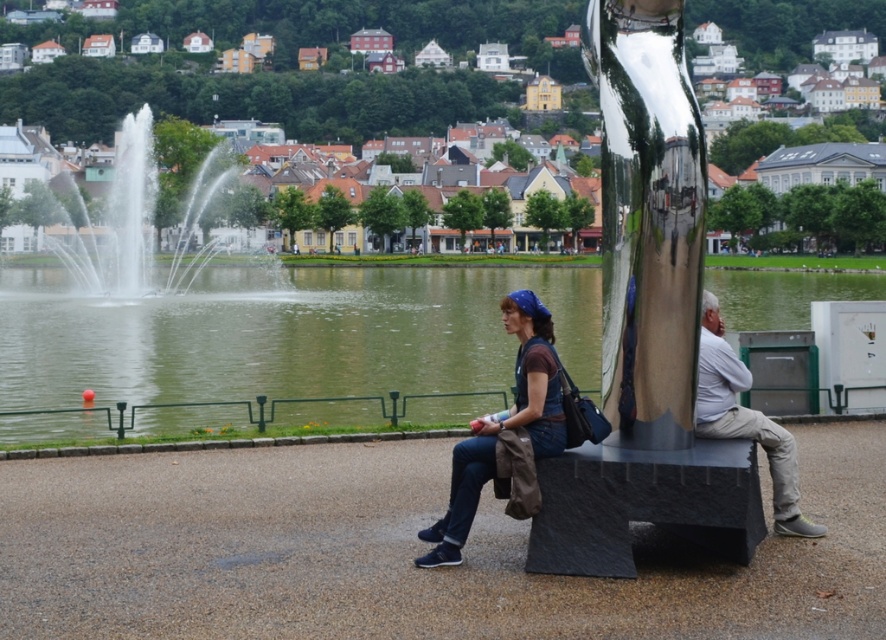
Question: Considering the real-world distances, which object is closest to the black textured bench at lower right?

Choices:
 (A) matte brown jacket at center
 (B) light gray cotton pants at right

Answer: (A)

Question: Is white water at center smaller than light gray cotton pants at right?

Choices:
 (A) no
 (B) yes

Answer: (A)

Question: Is matte brown jacket at center bigger than black textured bench at lower right?

Choices:
 (A) yes
 (B) no

Answer: (B)

Question: Is green water at center further to camera compared to matte black shirt at center?

Choices:
 (A) no
 (B) yes

Answer: (A)

Question: Among these objects, which one is nearest to the camera?

Choices:
 (A) green water at center
 (B) black textured bench at lower right
 (C) white water at center
 (D) light gray cotton pants at right

Answer: (B)

Question: Among these points, which one is farthest from the camera?

Choices:
 (A) (759, 540)
 (B) (604, 525)
 (C) (565, 275)

Answer: (C)